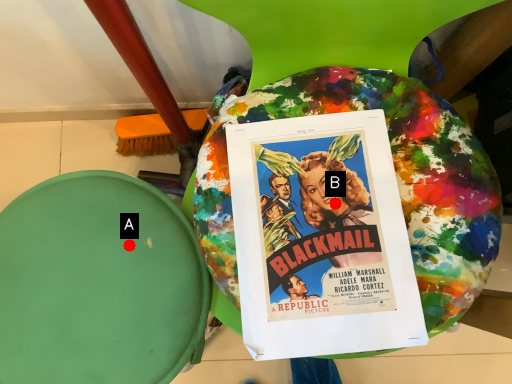
Question: Two points are circled on the image, labeled by A and B beside each circle. Which point appears closest to the camera in this image?

Choices:
 (A) A is closer
 (B) B is closer

Answer: (B)